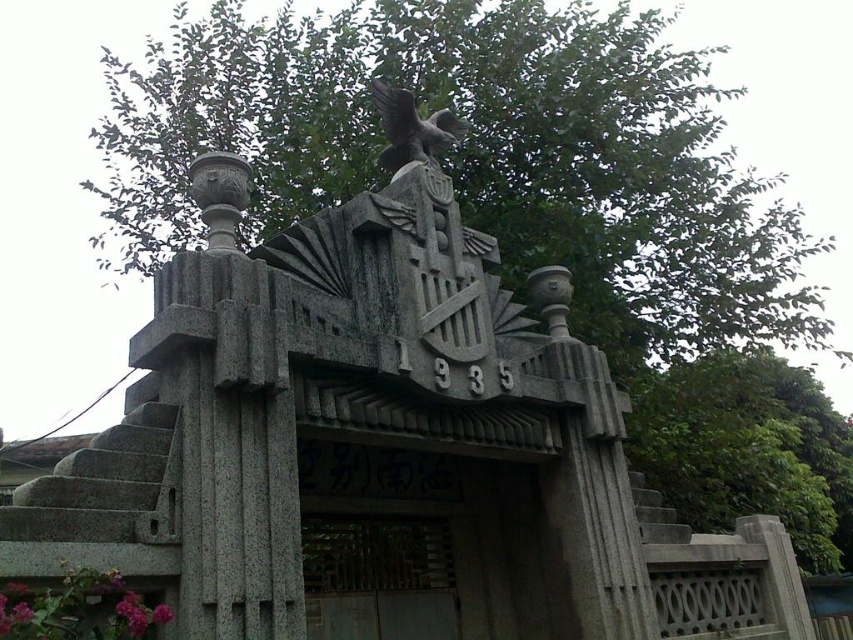
You are standing in front of the historical gate and notice two green leafy trees in the upper part of the image. Which tree, the green leafy tree at upper center or the green leafy tree at upper right, is taller?

The green leafy tree at upper center is taller than the green leafy tree at upper right according to the description.

You are an architect examining a historical monument. You notice the wooden gate at center and the gray stone eagle at upper center. Which object occupies a greater area in the image?

The wooden gate at center is larger in size than the gray stone eagle at upper center, so it occupies a greater area in the image.